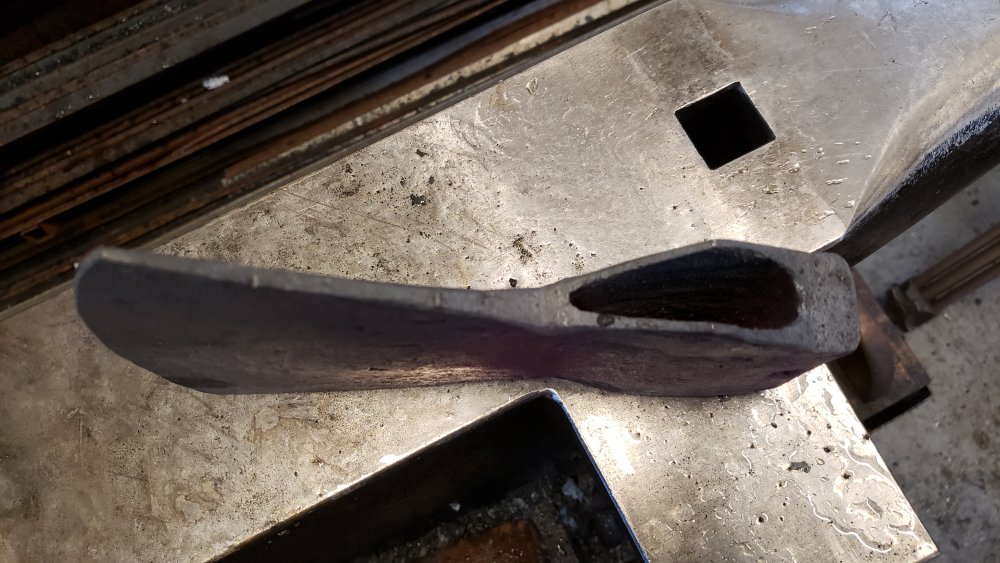
The width and height of the screenshot is (1000, 563). I want to click on handle, so [958, 227], [229, 285].